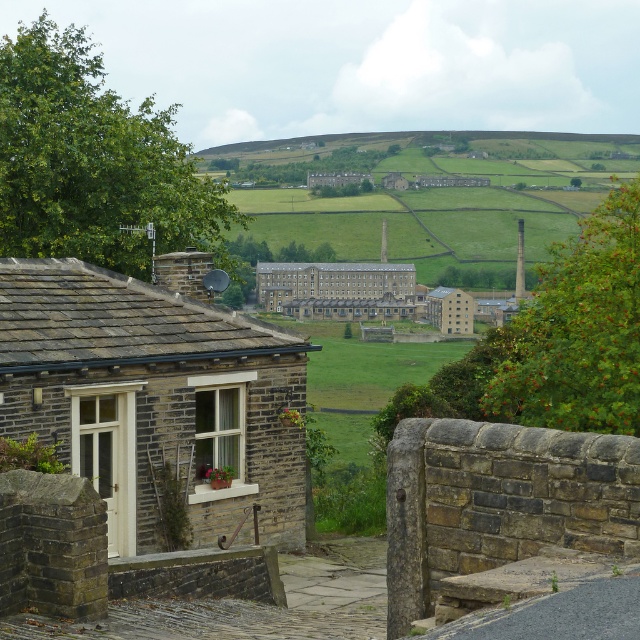
You are standing at the bottom of the incline near the brown brick cottage at lower left. You want to take a photo of the brown stone building at center. Which object will appear larger in the photo?

The brown brick cottage at lower left will appear larger in the photo because it is much taller than the brown stone building at center, and being closer to you, its size in the photo will be more prominent.